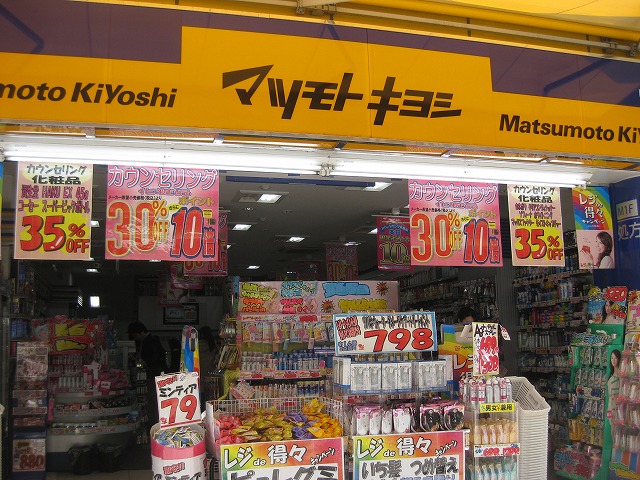
Where is `floor`? This screenshot has height=480, width=640. floor is located at coordinates pyautogui.click(x=124, y=472).